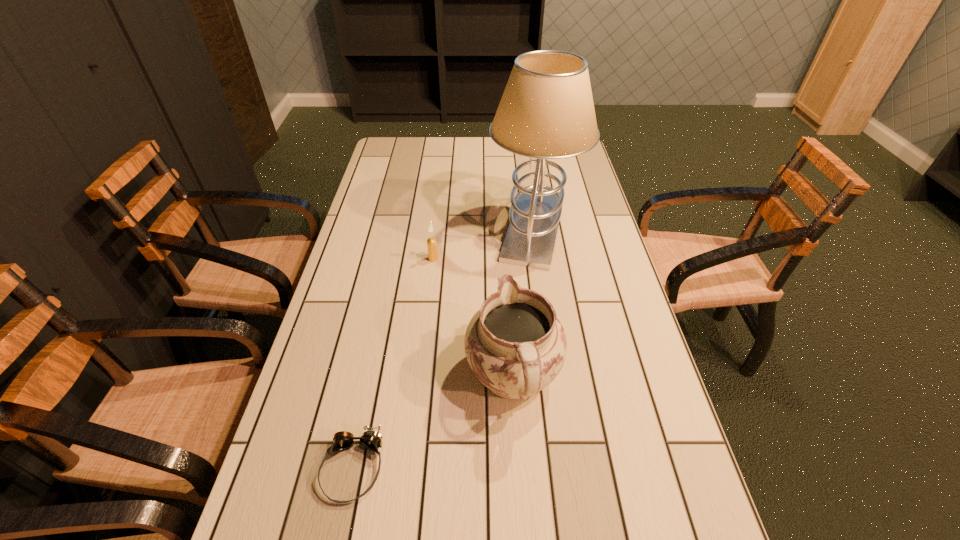
Locate an element on the screen. vacant space located on the spout of the third farthest object is located at coordinates (506, 263).

Locate an element on the screen. The width and height of the screenshot is (960, 540). free spot located 0.400m on the right of the third object from right to left is located at coordinates coord(571,259).

Identify the location of object at the left edge. The height and width of the screenshot is (540, 960). click(x=370, y=439).

This screenshot has width=960, height=540. What are the coordinates of `object that is at the right edge` in the screenshot? It's located at (546, 111).

In the image, there is a desktop. At what (x,y) coordinates should I click in order to perform the action: click on free space at the far edge. Please return your answer as a coordinate pair (x, y). Looking at the image, I should click on (459, 138).

In the image, there is a desktop. Where is `vacant region at the left edge`? This screenshot has width=960, height=540. vacant region at the left edge is located at coordinates [x=374, y=223].

What are the coordinates of `free point at the right edge` in the screenshot? It's located at (617, 375).

Identify the location of unoccupied area between the tallest object and the goggles. Image resolution: width=960 pixels, height=540 pixels. (444, 348).

Where is `vacant area that lies between the goggles and the table lamp`? This screenshot has width=960, height=540. vacant area that lies between the goggles and the table lamp is located at coordinates (444, 348).

The width and height of the screenshot is (960, 540). What are the coordinates of `vacant space in between the shortest object and the second tallest object` in the screenshot? It's located at (433, 423).